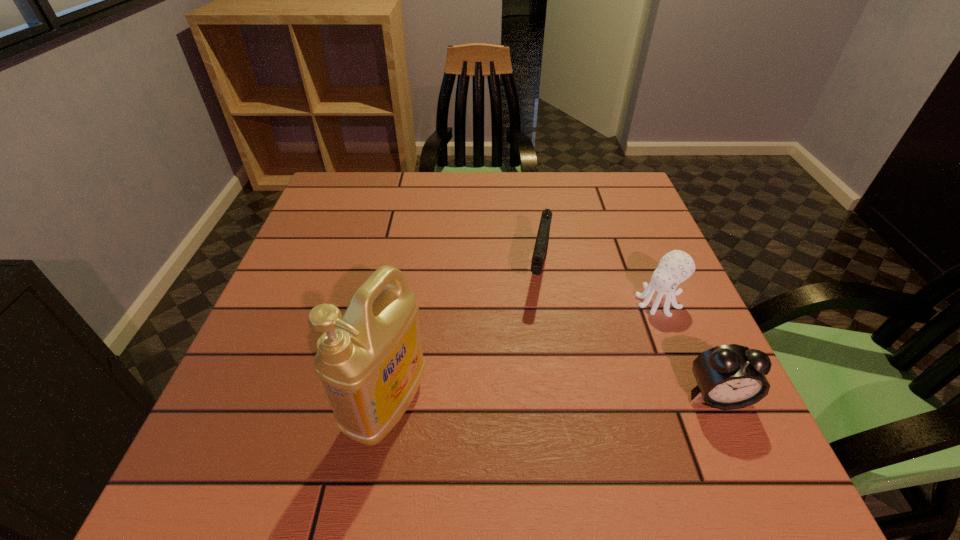
I want to click on free space on the desktop that is between the tallest object and the alarm clock and is positioned at the barrel of the third object from right to left, so click(x=513, y=402).

This screenshot has width=960, height=540. In order to click on vacant space on the desktop that is between the detergent and the alarm clock and is positioned on the front-facing side of the octopus in this screenshot , I will do `click(534, 401)`.